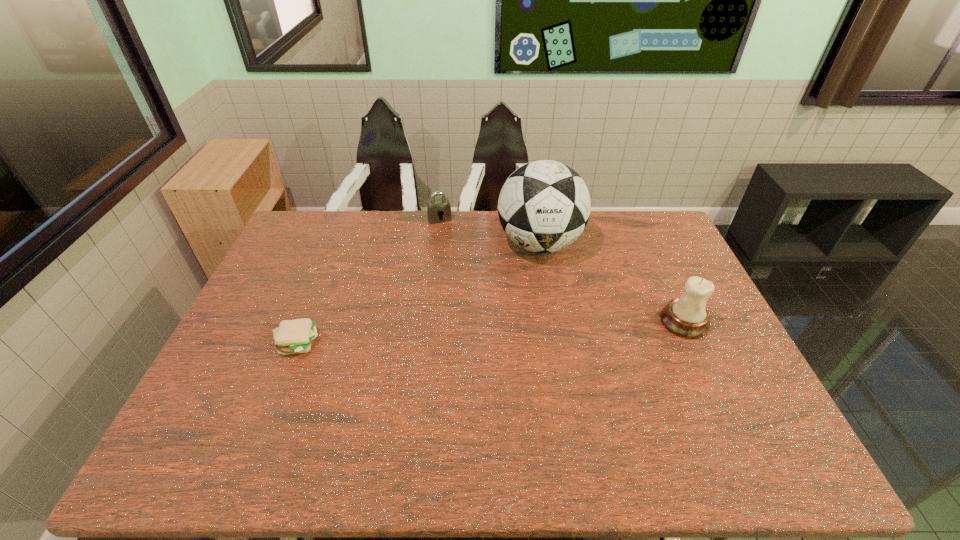
Image resolution: width=960 pixels, height=540 pixels. I want to click on vacant space at the far edge of the desktop, so click(373, 239).

What are the coordinates of `vacant space at the near edge of the desktop` in the screenshot? It's located at (346, 411).

In order to click on vacant space at the left edge of the desktop in this screenshot , I will do pos(314,276).

I want to click on free space at the right edge of the desktop, so click(748, 377).

The width and height of the screenshot is (960, 540). In the image, there is a desktop. Identify the location of vacant area at the near left corner. (237, 394).

Locate an element on the screen. free space between the shortest object and the padlock is located at coordinates (369, 281).

Image resolution: width=960 pixels, height=540 pixels. In order to click on free spot between the candle holder and the soccer ball in this screenshot , I will do `click(612, 282)`.

Locate an element on the screen. free space between the padlock and the patty is located at coordinates (369, 281).

Find the location of a particular element. vacant area between the second object from right to left and the shortest object is located at coordinates (419, 293).

The height and width of the screenshot is (540, 960). In order to click on vacant space that is in between the third object from left to right and the leftmost object in this screenshot , I will do `click(419, 293)`.